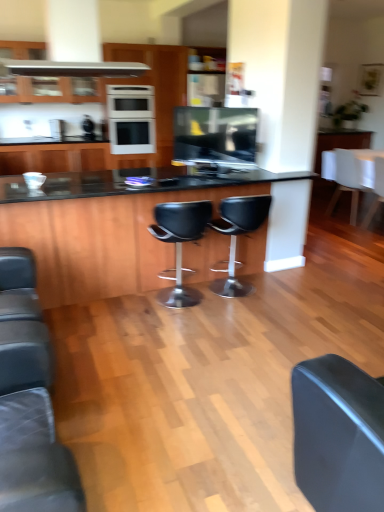
Where is `unoccupied region to the right of black leather stool at center, which is counted as the 4th chair, starting from the right`? This screenshot has height=512, width=384. unoccupied region to the right of black leather stool at center, which is counted as the 4th chair, starting from the right is located at coordinates (244, 317).